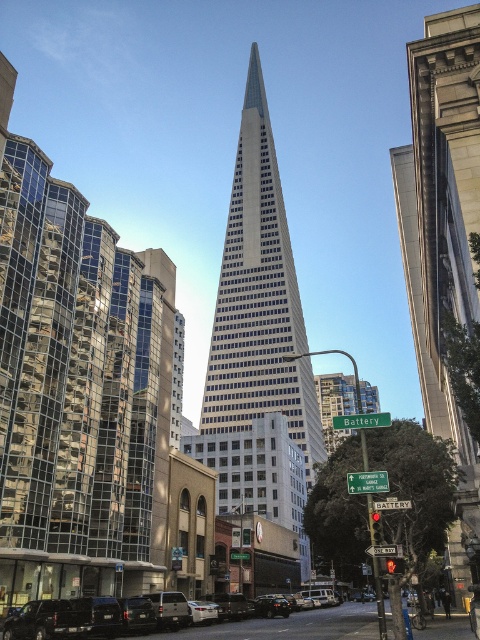
Question: Which point is farther to the camera?

Choices:
 (A) (255, 305)
 (B) (280, 600)
 (C) (447, 253)
 (D) (191, 616)

Answer: (A)

Question: Is glassy steel skyscraper at center in front of black matte suv at center?

Choices:
 (A) no
 (B) yes

Answer: (A)

Question: Considering the relative positions of glassy steel skyscraper at center and gray stone building at right in the image provided, where is glassy steel skyscraper at center located with respect to gray stone building at right?

Choices:
 (A) right
 (B) left

Answer: (B)

Question: Among these points, which one is farthest from the camera?

Choices:
 (A) (291, 520)
 (B) (340, 625)

Answer: (A)

Question: Which of the following is the closest to the observer?

Choices:
 (A) (200, 621)
 (B) (303, 436)

Answer: (A)

Question: Is the position of gray stone building at right less distant than that of shiny black sedan at center?

Choices:
 (A) no
 (B) yes

Answer: (B)